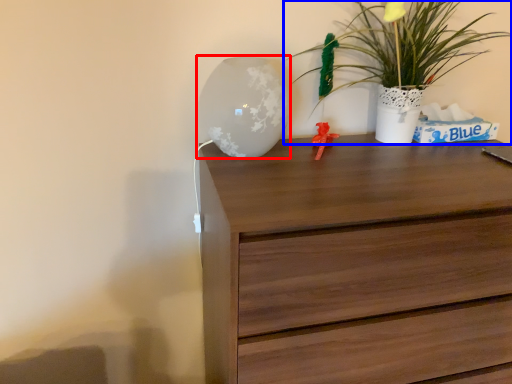
Question: Which object appears closest to the camera in this image, table lamp (highlighted by a red box) or houseplant (highlighted by a blue box)?

Choices:
 (A) table lamp
 (B) houseplant

Answer: (A)